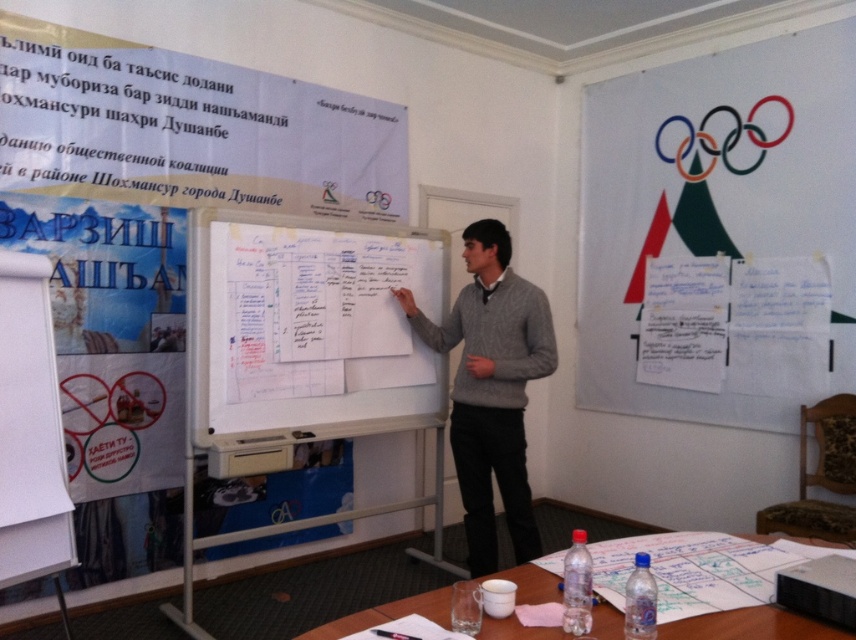
You are a student in the classroom and need to write a long essay. Which object, the white paperboard at upper left or the white paper at upper right, would be more suitable for writing a lengthy text?

The white paperboard at upper left is more suitable for writing a lengthy text because its width is larger than the white paper at upper right.

You are a student sitting in the classroom and need to refer to the white paper at upper right and the gray sweater at center. Which object is taller when viewed from your seat?

The white paper at upper right is taller than the gray sweater at center.